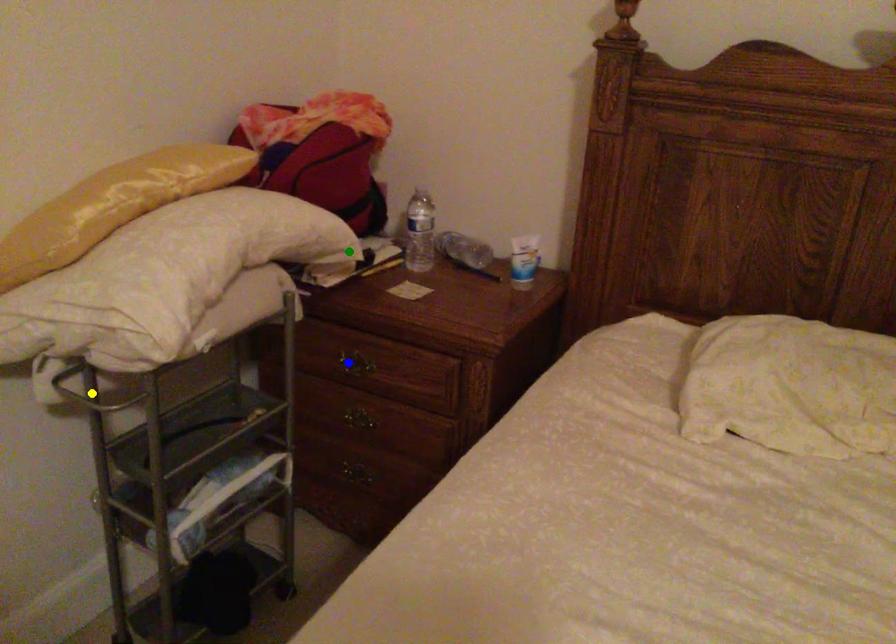
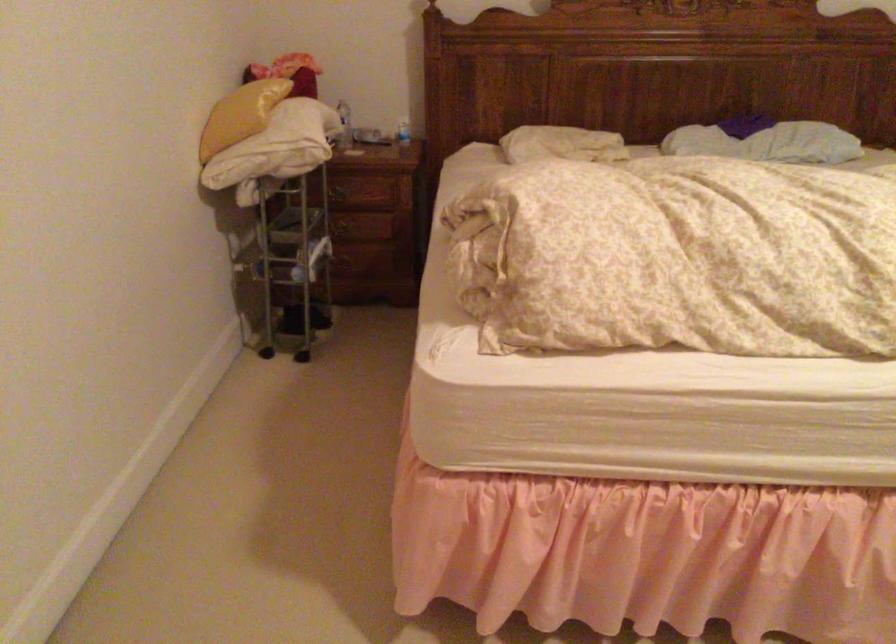
I am providing you with two images of the same scene from different viewpoints. Three points are marked in image1. Which point corresponds to a part or object that is occluded in image2?In image1, three points are marked. Which of them correspond to a part or object that is occluded in image2?Among the three points shown in image1, which one corresponds to a part or object that is no longer visible due to occlusion in image2?

yellow point cannot be seen in image2.